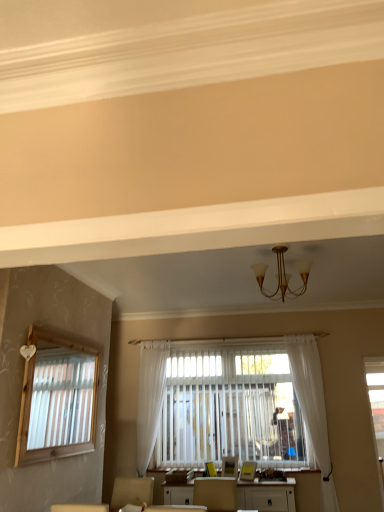
Question: Does white sheer curtain at center, marked as the 1th curtain in a left-to-right arrangement, have a lesser height compared to gold metallic chandelier at center?

Choices:
 (A) yes
 (B) no

Answer: (B)

Question: From the image's perspective, does white sheer curtain at center, marked as the 1th curtain in a left-to-right arrangement, appear higher than gold metallic chandelier at center?

Choices:
 (A) yes
 (B) no

Answer: (B)

Question: Can you confirm if white sheer curtain at center, which is the 2th curtain from right to left, is smaller than gold metallic chandelier at center?

Choices:
 (A) no
 (B) yes

Answer: (A)

Question: Is white sheer curtain at center, which is the 2th curtain from right to left, bigger than gold metallic chandelier at center?

Choices:
 (A) yes
 (B) no

Answer: (A)

Question: Is white sheer curtain at center, marked as the 1th curtain in a left-to-right arrangement, oriented away from gold metallic chandelier at center?

Choices:
 (A) no
 (B) yes

Answer: (A)

Question: Relative to white sheer curtain at right, acting as the first curtain starting from the right, is white glossy table at center in front or behind?

Choices:
 (A) behind
 (B) front

Answer: (B)

Question: Considering the positions of white glossy table at center and white sheer curtain at right, acting as the first curtain starting from the right, in the image, is white glossy table at center taller or shorter than white sheer curtain at right, acting as the first curtain starting from the right,?

Choices:
 (A) tall
 (B) short

Answer: (B)

Question: Is white glossy table at center situated inside white sheer curtain at right, acting as the first curtain starting from the right, or outside?

Choices:
 (A) outside
 (B) inside

Answer: (A)

Question: Is point (284, 489) closer or farther from the camera than point (304, 351)?

Choices:
 (A) farther
 (B) closer

Answer: (B)

Question: From a real-world perspective, is gold metallic chandelier at center positioned above or below white glossy table at center?

Choices:
 (A) below
 (B) above

Answer: (B)

Question: From the image's perspective, is gold metallic chandelier at center positioned above or below white glossy table at center?

Choices:
 (A) above
 (B) below

Answer: (A)

Question: Is gold metallic chandelier at center situated inside white glossy table at center or outside?

Choices:
 (A) inside
 (B) outside

Answer: (B)

Question: Is point (256, 272) closer or farther from the camera than point (248, 505)?

Choices:
 (A) closer
 (B) farther

Answer: (A)

Question: In the image, is white sheer curtain at center, which is the 2th curtain from right to left, positioned in front of or behind white sheer curtain at right, acting as the first curtain starting from the right?

Choices:
 (A) front
 (B) behind

Answer: (B)

Question: From their relative heights in the image, would you say white sheer curtain at center, marked as the 1th curtain in a left-to-right arrangement, is taller or shorter than white sheer curtain at right, which ranks as the second curtain in left-to-right order?

Choices:
 (A) tall
 (B) short

Answer: (B)